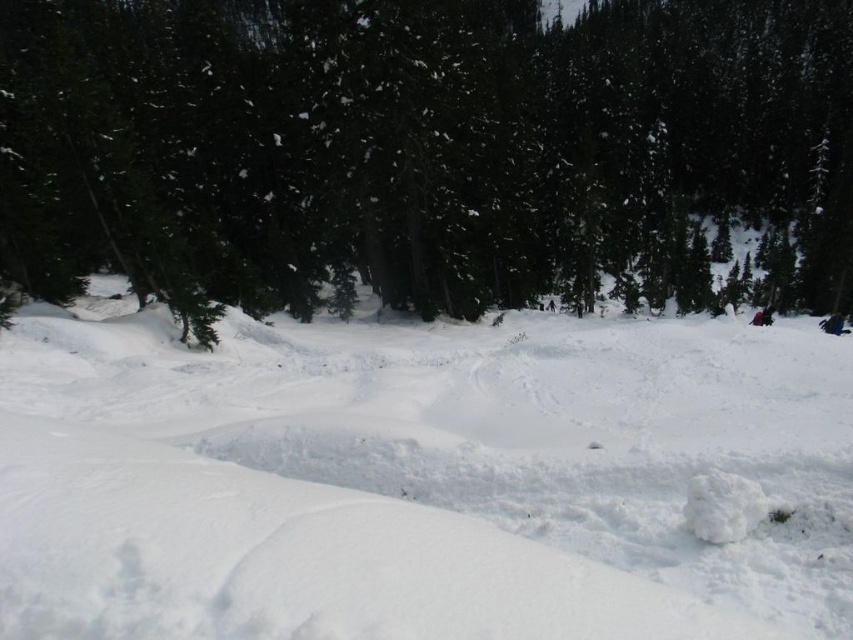
Question: Does white fluffy snow at center have a greater width compared to green matte tree at upper center?

Choices:
 (A) no
 (B) yes

Answer: (A)

Question: Among these objects, which one is farthest from the camera?

Choices:
 (A) white fluffy snow at center
 (B) green matte tree at upper center

Answer: (B)

Question: Does white fluffy snow at center appear under green matte tree at upper center?

Choices:
 (A) no
 (B) yes

Answer: (B)

Question: Among these objects, which one is nearest to the camera?

Choices:
 (A) green matte tree at upper center
 (B) white fluffy snow at center

Answer: (B)

Question: Observing the image, what is the correct spatial positioning of white fluffy snow at center in reference to green matte tree at upper center?

Choices:
 (A) left
 (B) right

Answer: (A)